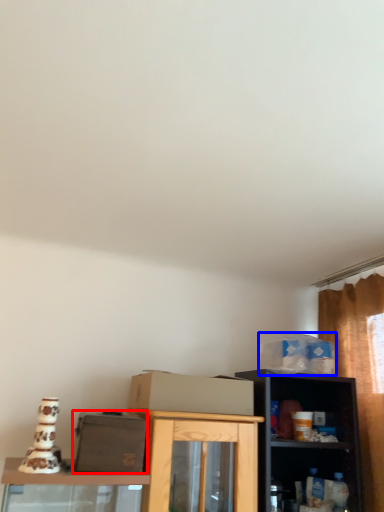
Question: Among these objects, which one is nearest to the camera, box (highlighted by a red box) or box (highlighted by a blue box)?

Choices:
 (A) box
 (B) box

Answer: (A)